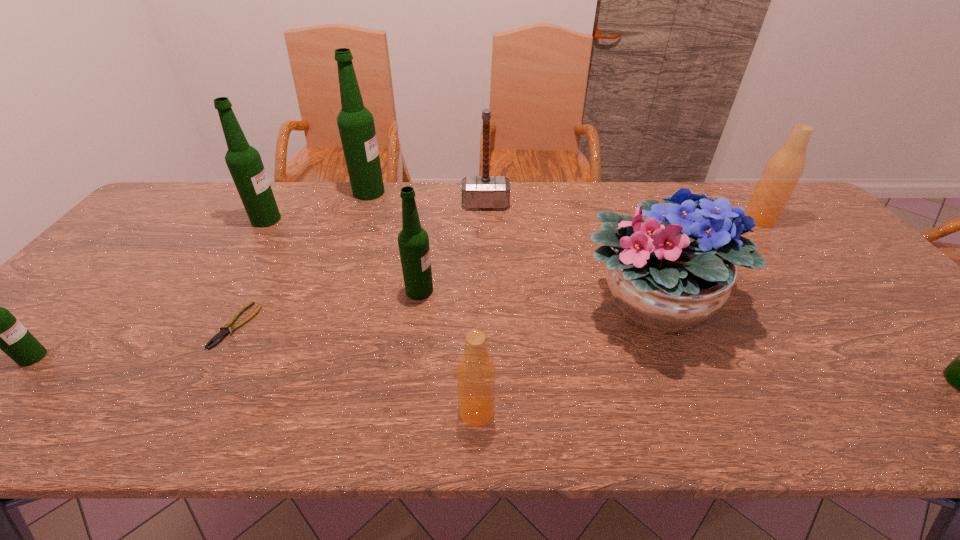
In order to click on free point between the second nearest green beer bottle and the second tallest beer bottle in this screenshot , I will do `click(149, 288)`.

You are a GUI agent. You are given a task and a screenshot of the screen. Output one action in this format:
    pyautogui.click(x=<x>, y=<y>)
    Task: Click on the free space that is in between the fourth beer bottle from left to right and the smaller tan beer bottle
    The height and width of the screenshot is (540, 960).
    Given the screenshot: What is the action you would take?
    pyautogui.click(x=448, y=351)

The height and width of the screenshot is (540, 960). Identify the location of free space that is in between the leftmost beer bottle and the bouquet. (342, 330).

I want to click on the eighth closest object to the third object from right to left, so click(244, 162).

Select which object appears as the closest to the fourth smallest green beer bottle. Please provide its 2D coordinates. Your answer should be formatted as a tuple, i.e. [(x, y)], where the tuple contains the x and y coordinates of a point satisfying the conditions above.

[(355, 122)]

Identify the location of beer bottle that is the fifth nearest to the third object from left to right. (475, 371).

The width and height of the screenshot is (960, 540). What are the coordinates of `beer bottle identified as the sixth closest to the rightmost green beer bottle` in the screenshot? It's located at (0, 329).

Find the location of `green beer bottle that is the fourth nearest to the tallest object`. green beer bottle that is the fourth nearest to the tallest object is located at coordinates (959, 373).

Find the location of a particular element. This screenshot has width=960, height=540. green beer bottle that stands as the second closest to the rightmost beer bottle is located at coordinates (355, 122).

At what (x,y) coordinates should I click in order to perform the action: click on free spot that satisfies the following two spatial constraints: 1. on the striking surface of the hammer; 2. on the label of the smallest green beer bottle. Please return your answer as a coordinate pair (x, y). Looking at the image, I should click on (488, 357).